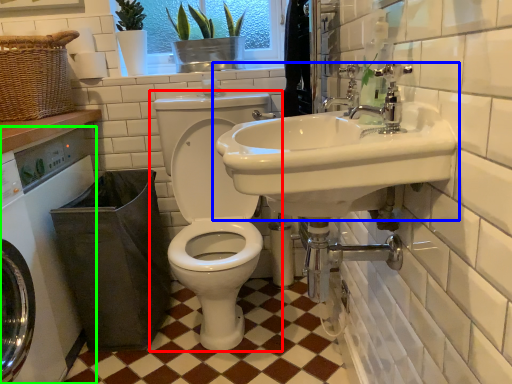
Question: Estimate the real-world distances between objects in this image. Which object is farther from toilet (highlighted by a red box), sink (highlighted by a blue box) or washing machine (highlighted by a green box)?

Choices:
 (A) sink
 (B) washing machine

Answer: (A)